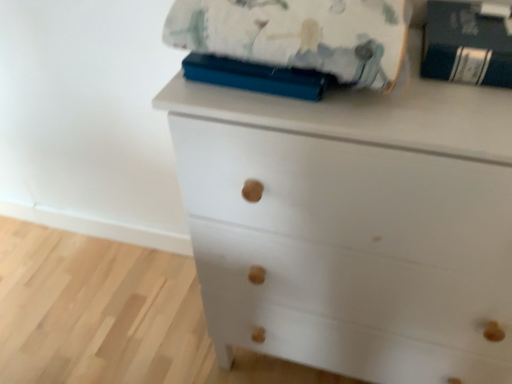
Question: From a real-world perspective, does fluffy cotton blanket at upper center stand above dark blue hardcover book at upper right?

Choices:
 (A) no
 (B) yes

Answer: (B)

Question: Does fluffy cotton blanket at upper center appear on the left side of dark blue hardcover book at upper right?

Choices:
 (A) no
 (B) yes

Answer: (B)

Question: From the image's perspective, is fluffy cotton blanket at upper center beneath dark blue hardcover book at upper right?

Choices:
 (A) yes
 (B) no

Answer: (B)

Question: Can you confirm if fluffy cotton blanket at upper center is positioned to the right of dark blue hardcover book at upper right?

Choices:
 (A) no
 (B) yes

Answer: (A)

Question: Is fluffy cotton blanket at upper center smaller than dark blue hardcover book at upper right?

Choices:
 (A) yes
 (B) no

Answer: (B)

Question: Is fluffy cotton blanket at upper center far from dark blue hardcover book at upper right?

Choices:
 (A) no
 (B) yes

Answer: (A)

Question: Does white matte chest of drawers at center have a lesser height compared to fluffy cotton blanket at upper center?

Choices:
 (A) yes
 (B) no

Answer: (B)

Question: Is white matte chest of drawers at center looking in the opposite direction of fluffy cotton blanket at upper center?

Choices:
 (A) no
 (B) yes

Answer: (A)

Question: Is white matte chest of drawers at center not inside fluffy cotton blanket at upper center?

Choices:
 (A) no
 (B) yes

Answer: (B)

Question: Is white matte chest of drawers at center to the left of fluffy cotton blanket at upper center from the viewer's perspective?

Choices:
 (A) yes
 (B) no

Answer: (B)

Question: From the image's perspective, would you say white matte chest of drawers at center is shown under fluffy cotton blanket at upper center?

Choices:
 (A) yes
 (B) no

Answer: (A)

Question: Is there a large distance between white matte chest of drawers at center and fluffy cotton blanket at upper center?

Choices:
 (A) no
 (B) yes

Answer: (A)

Question: Is fluffy cotton blanket at upper center shorter than white matte chest of drawers at center?

Choices:
 (A) yes
 (B) no

Answer: (A)